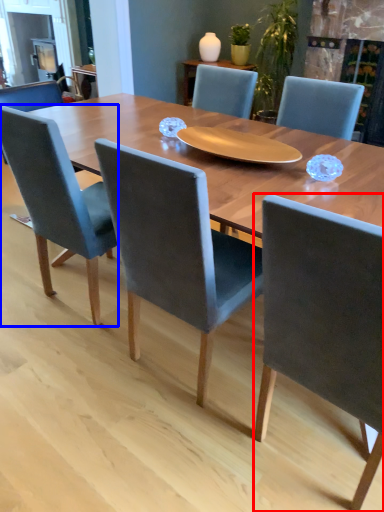
Question: Which object appears closest to the camera in this image, chair (highlighted by a red box) or chair (highlighted by a blue box)?

Choices:
 (A) chair
 (B) chair

Answer: (A)